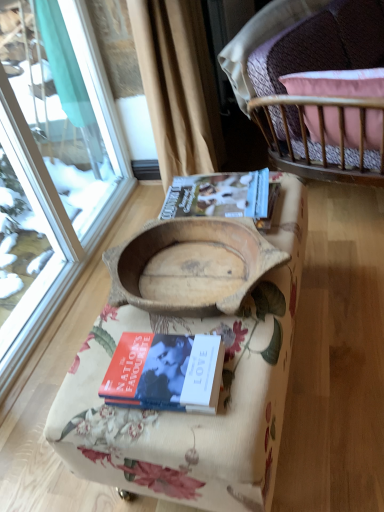
Question: Is wooden bowl at center to the right of wooden cradle at center from the viewer's perspective?

Choices:
 (A) no
 (B) yes

Answer: (B)

Question: Can you confirm if wooden bowl at center is bigger than wooden cradle at center?

Choices:
 (A) no
 (B) yes

Answer: (B)

Question: Considering the relative sizes of wooden bowl at center and wooden cradle at center in the image provided, is wooden bowl at center thinner than wooden cradle at center?

Choices:
 (A) no
 (B) yes

Answer: (B)

Question: Is wooden bowl at center completely or partially outside of wooden cradle at center?

Choices:
 (A) no
 (B) yes

Answer: (B)

Question: Does wooden bowl at center lie in front of wooden cradle at center?

Choices:
 (A) no
 (B) yes

Answer: (B)

Question: Looking at their shapes, would you say pink fabric cushion at upper right is wider or thinner than hardcover book at center, the first book in the front-to-back sequence?

Choices:
 (A) wide
 (B) thin

Answer: (A)

Question: From a real-world perspective, is pink fabric cushion at upper right positioned above or below hardcover book at center, the first book in the front-to-back sequence?

Choices:
 (A) above
 (B) below

Answer: (A)

Question: Considering the relative positions of pink fabric cushion at upper right and hardcover book at center, which is the first book from bottom to top, in the image provided, is pink fabric cushion at upper right to the left or to the right of hardcover book at center, which is the first book from bottom to top,?

Choices:
 (A) left
 (B) right

Answer: (B)

Question: Is pink fabric cushion at upper right bigger or smaller than hardcover book at center, marked as the 2th book in a top-to-bottom arrangement?

Choices:
 (A) big
 (B) small

Answer: (A)

Question: Looking at the image, does matte brown book at center, positioned as the 2th book in front-to-back order, seem bigger or smaller compared to wooden cradle at center?

Choices:
 (A) big
 (B) small

Answer: (B)

Question: Considering the positions of matte brown book at center, arranged as the second book when ordered from the bottom, and wooden cradle at center in the image, is matte brown book at center, arranged as the second book when ordered from the bottom, wider or thinner than wooden cradle at center?

Choices:
 (A) thin
 (B) wide

Answer: (A)

Question: Relative to wooden cradle at center, is matte brown book at center, which ranks as the 1th book in back-to-front order, in front or behind?

Choices:
 (A) behind
 (B) front

Answer: (A)

Question: Considering the positions of point (225, 203) and point (243, 249), is point (225, 203) closer or farther from the camera than point (243, 249)?

Choices:
 (A) farther
 (B) closer

Answer: (A)

Question: From a real-world perspective, is matte brown book at center, arranged as the second book when ordered from the bottom, positioned above or below hardcover book at center, marked as the 2th book in a top-to-bottom arrangement?

Choices:
 (A) above
 (B) below

Answer: (A)

Question: From the image's perspective, is matte brown book at center, acting as the first book starting from the top, positioned above or below hardcover book at center, marked as the 2th book in a top-to-bottom arrangement?

Choices:
 (A) above
 (B) below

Answer: (A)